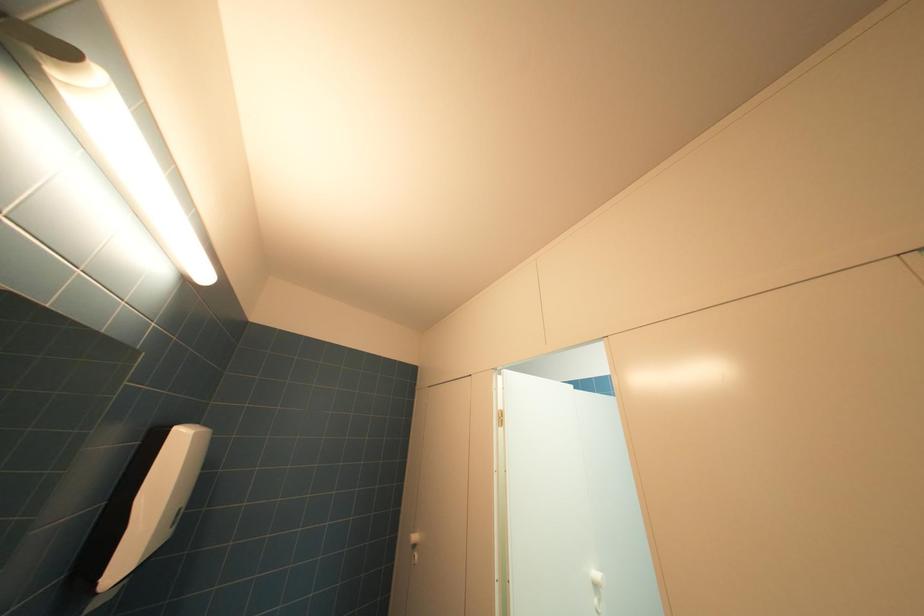
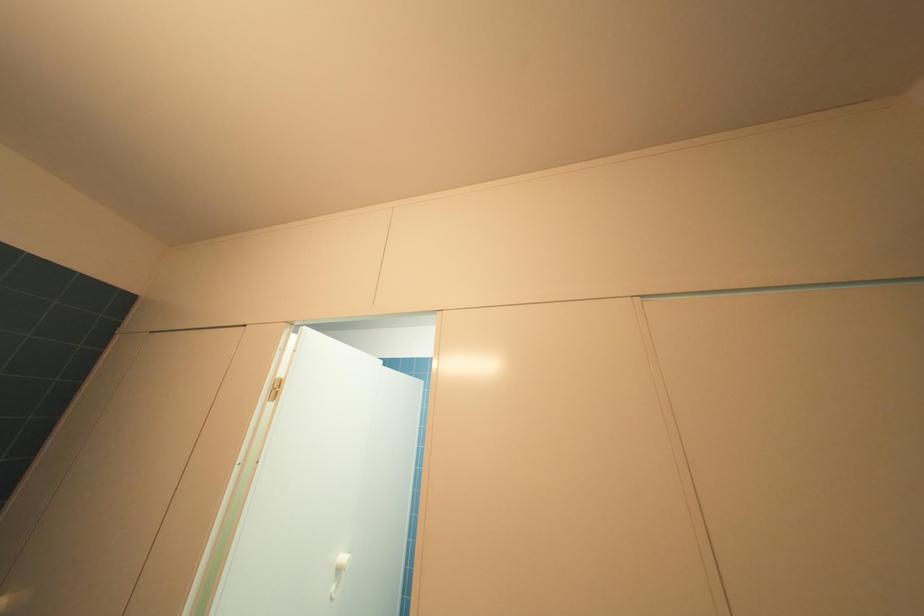
Question: The camera is either moving clockwise (left) or counter-clockwise (right) around the object. The first image is from the beginning of the video and the second image is from the end. Is the camera moving left or right when shooting the video?

Choices:
 (A) Left
 (B) Right

Answer: (A)